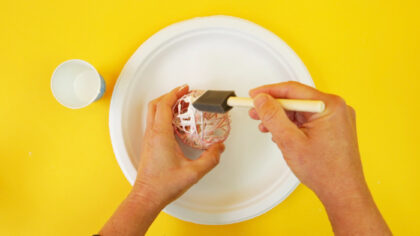
Locate an element on the screen. cup is located at coordinates (81, 73).